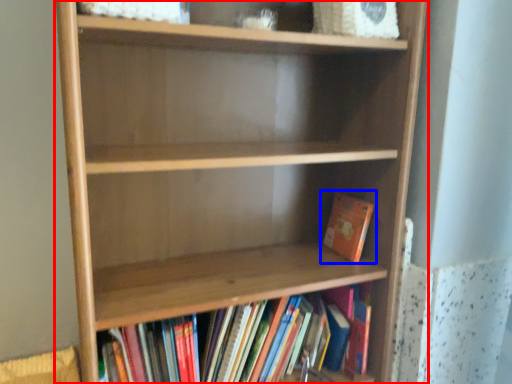
Question: Which object appears farthest to the camera in this image, shelf (highlighted by a red box) or book (highlighted by a blue box)?

Choices:
 (A) shelf
 (B) book

Answer: (B)